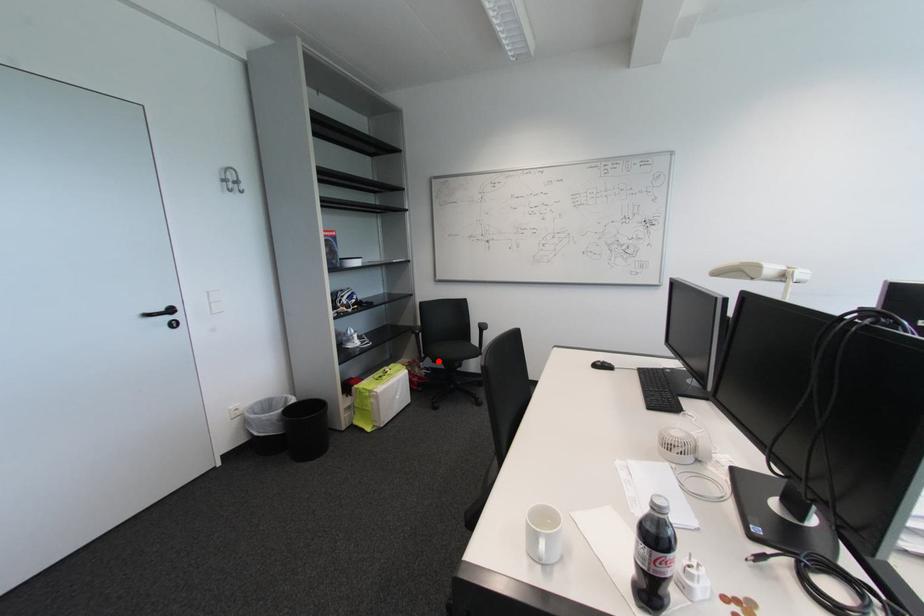
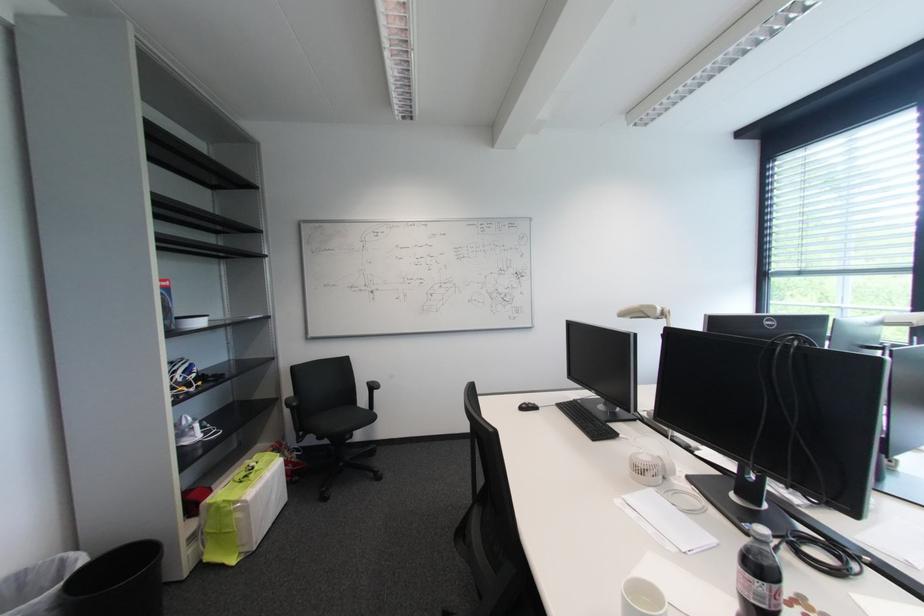
Question: I am providing you with two images of the same scene from different viewpoints. Given a red point in image1, look at the same physical point in image2. Is it:

Choices:
 (A) Closer to the viewpoint
 (B) Farther from the viewpoint

Answer: (B)